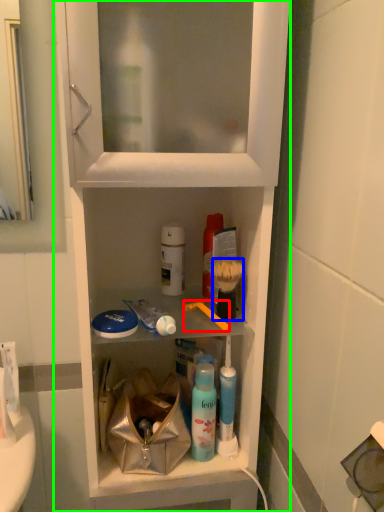
Question: Which object is the closest to the toothbrush (highlighted by a red box)? Choose among these: brush (highlighted by a blue box) or cabinetry (highlighted by a green box).

Choices:
 (A) brush
 (B) cabinetry

Answer: (A)